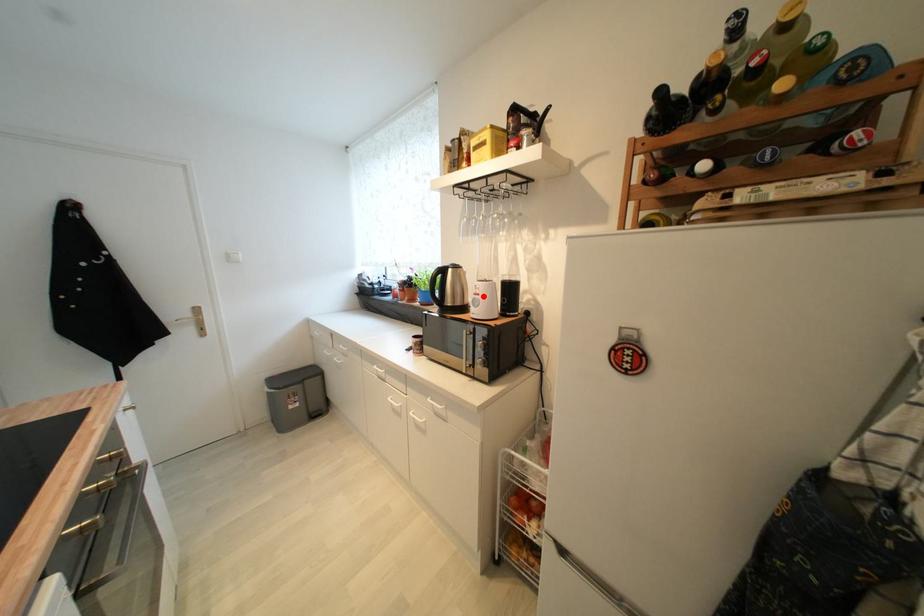
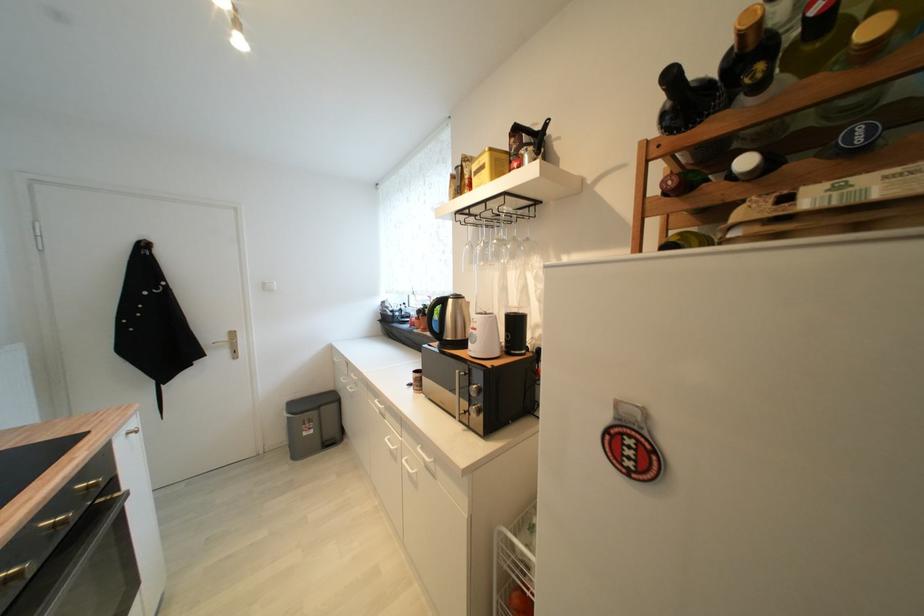
The point at the highlighted location is marked in the first image. Where is the corresponding point in the second image?

(480, 331)